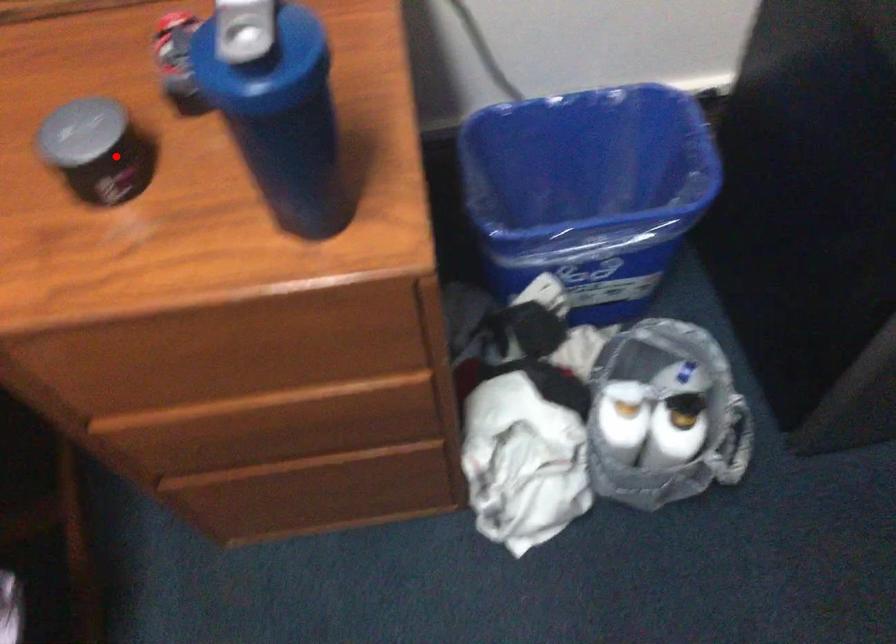
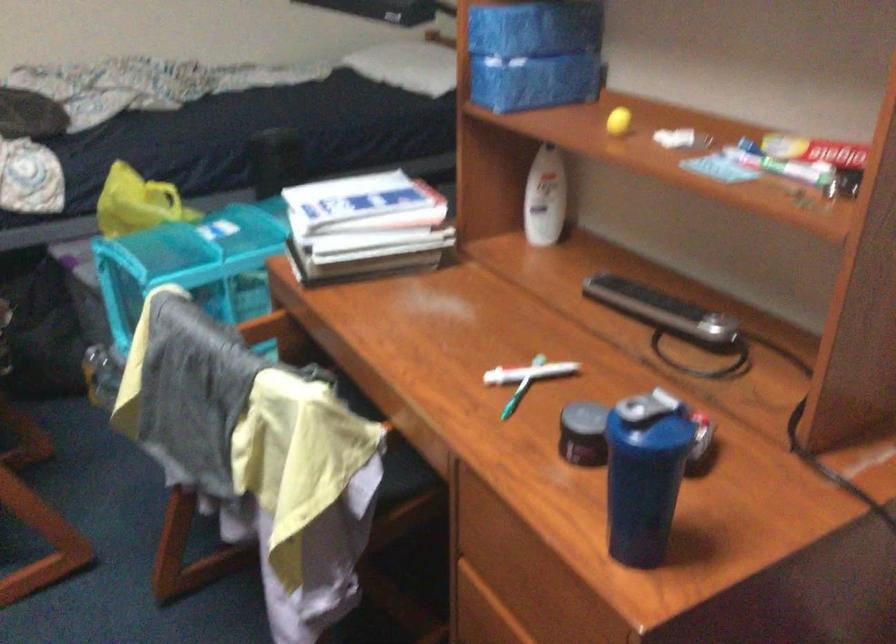
Where in the second image is the point corresponding to the highlighted location from the first image?

(584, 433)